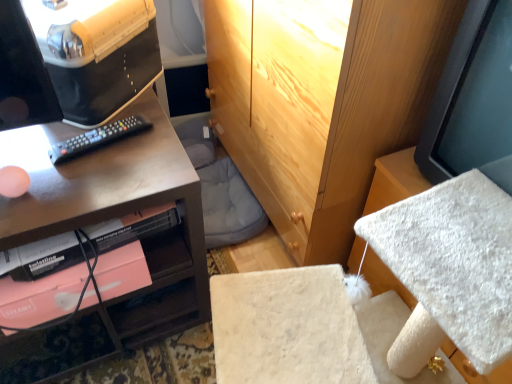
This screenshot has width=512, height=384. I want to click on vacant space that's between black plastic remote at left and matte black monitor at upper left, so click(91, 135).